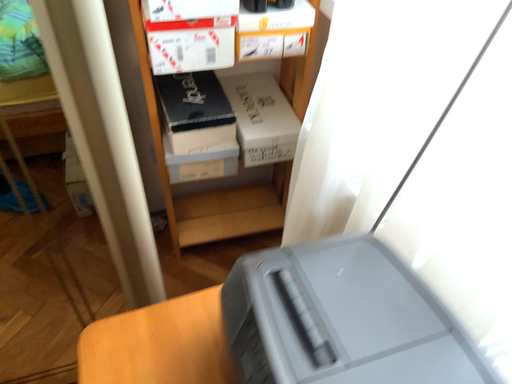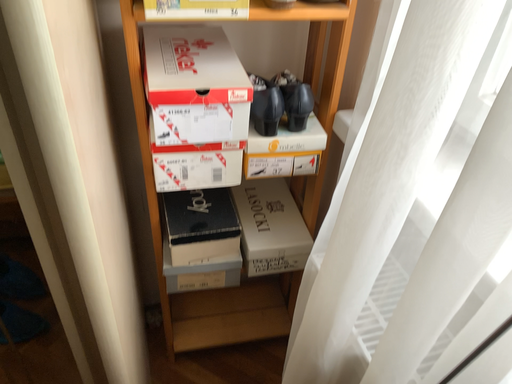
Question: How did the camera likely rotate when shooting the video?

Choices:
 (A) rotated upward
 (B) rotated downward

Answer: (A)